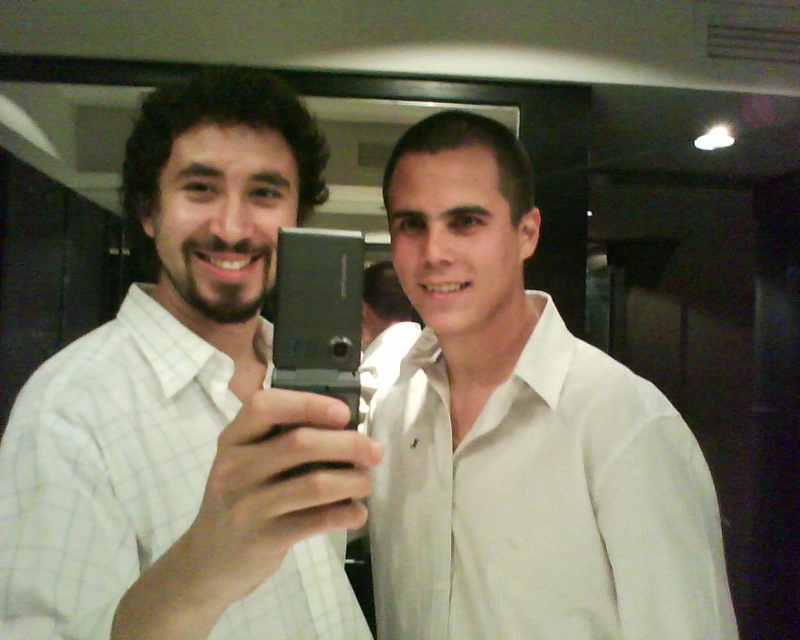
Question: Does white textured shirt at center appear on the right side of white checkered shirt at center?

Choices:
 (A) yes
 (B) no

Answer: (A)

Question: Can you confirm if white textured shirt at center is thinner than white checkered shirt at center?

Choices:
 (A) yes
 (B) no

Answer: (B)

Question: Which of the following is the closest to the observer?

Choices:
 (A) white textured shirt at center
 (B) white checkered shirt at center

Answer: (B)

Question: Does white textured shirt at center appear over white checkered shirt at center?

Choices:
 (A) yes
 (B) no

Answer: (A)

Question: Which of the following is the farthest from the observer?

Choices:
 (A) (700, 582)
 (B) (266, 586)

Answer: (A)